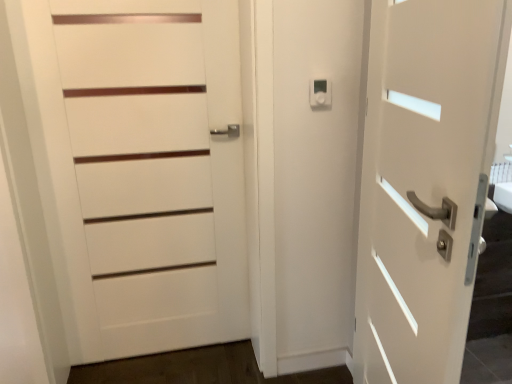
Question: Considering the relative sizes of white matte door at right, positioned as the 2th door in left-to-right order, and white plastic thermostat at upper center in the image provided, is white matte door at right, positioned as the 2th door in left-to-right order, bigger than white plastic thermostat at upper center?

Choices:
 (A) yes
 (B) no

Answer: (A)

Question: Is white matte door at right, positioned as the 2th door in left-to-right order, next to white plastic thermostat at upper center and touching it?

Choices:
 (A) no
 (B) yes

Answer: (A)

Question: Is white matte door at right, positioned as the 2th door in left-to-right order, shorter than white plastic thermostat at upper center?

Choices:
 (A) yes
 (B) no

Answer: (B)

Question: Is white plastic thermostat at upper center completely or partially inside white matte door at right, positioned as the 2th door in left-to-right order?

Choices:
 (A) no
 (B) yes

Answer: (A)

Question: Could you tell me if white matte door at right, positioned as the 2th door in left-to-right order, is turned towards white plastic thermostat at upper center?

Choices:
 (A) no
 (B) yes

Answer: (B)

Question: Can we say white matte door at right, which is counted as the first door, starting from the right, lies outside white plastic thermostat at upper center?

Choices:
 (A) yes
 (B) no

Answer: (A)

Question: Can you confirm if white matte door at left, positioned as the second door in right-to-left order, is shorter than white matte door at right, positioned as the 2th door in left-to-right order?

Choices:
 (A) no
 (B) yes

Answer: (A)

Question: Is white matte door at left, positioned as the second door in right-to-left order, to the left of white matte door at right, which is counted as the first door, starting from the right, from the viewer's perspective?

Choices:
 (A) yes
 (B) no

Answer: (A)

Question: Does white matte door at left, positioned as the second door in right-to-left order, have a lesser width compared to white matte door at right, positioned as the 2th door in left-to-right order?

Choices:
 (A) no
 (B) yes

Answer: (B)

Question: Would you say white matte door at right, positioned as the 2th door in left-to-right order, is part of white matte door at left, the 1th door from the left,'s contents?

Choices:
 (A) no
 (B) yes

Answer: (A)

Question: Can you confirm if white matte door at left, positioned as the second door in right-to-left order, is taller than white matte door at right, positioned as the 2th door in left-to-right order?

Choices:
 (A) no
 (B) yes

Answer: (B)

Question: Is white matte door at left, the 1th door from the left, completely or partially outside of white matte door at right, positioned as the 2th door in left-to-right order?

Choices:
 (A) no
 (B) yes

Answer: (B)

Question: From the image's perspective, is white plastic thermostat at upper center above white matte door at left, positioned as the second door in right-to-left order?

Choices:
 (A) no
 (B) yes

Answer: (B)